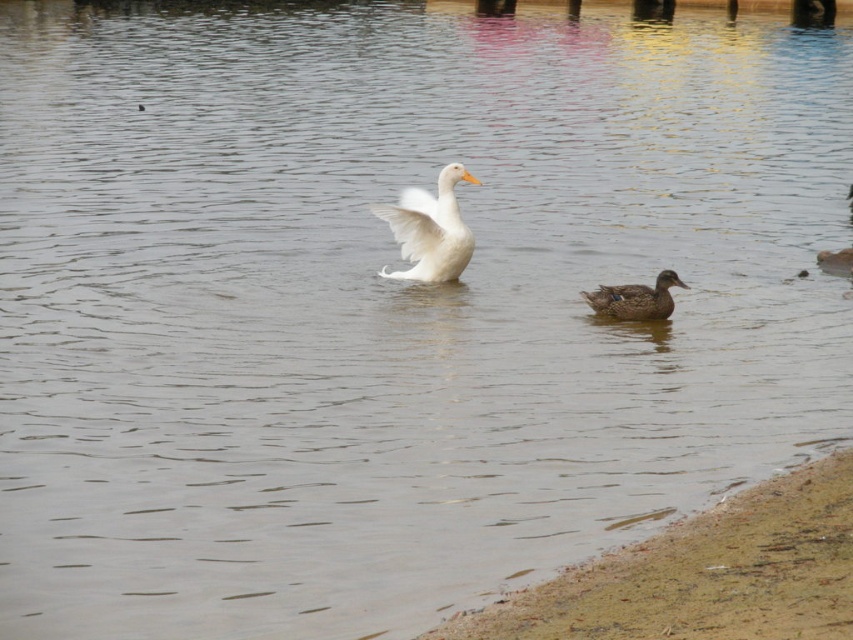
You are a GUI agent. You are given a task and a screenshot of the screen. Output one action in this format:
    pyautogui.click(x=<x>, y=<y>)
    Task: Click on the white feathered duck at center
    
    Given the screenshot: What is the action you would take?
    pyautogui.click(x=428, y=228)

Measure the distance between white feathered duck at center and camera.

They are 11.85 meters apart.

The image size is (853, 640). In order to click on white feathered duck at center in this screenshot , I will do `click(428, 228)`.

Describe the element at coordinates (704, 573) in the screenshot. I see `brown sand at lower right` at that location.

This screenshot has width=853, height=640. I want to click on brown sand at lower right, so click(704, 573).

In the scene shown: Between brown sand at lower right and white feathered duck at center, which one appears on the left side from the viewer's perspective?

white feathered duck at center is more to the left.

Is point (509, 616) more distant than point (425, 200)?

No, it is not.

You are a GUI agent. You are given a task and a screenshot of the screen. Output one action in this format:
    pyautogui.click(x=<x>, y=<y>)
    Task: Click on the brown sand at lower right
    The width and height of the screenshot is (853, 640).
    Given the screenshot: What is the action you would take?
    pyautogui.click(x=704, y=573)